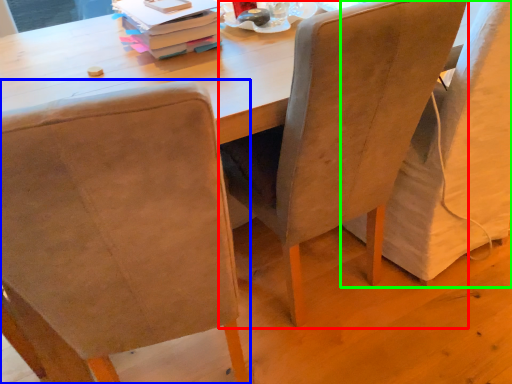
Question: Which object is the farthest from chair (highlighted by a red box)? Choose among these: chair (highlighted by a blue box) or chair (highlighted by a green box).

Choices:
 (A) chair
 (B) chair

Answer: (A)